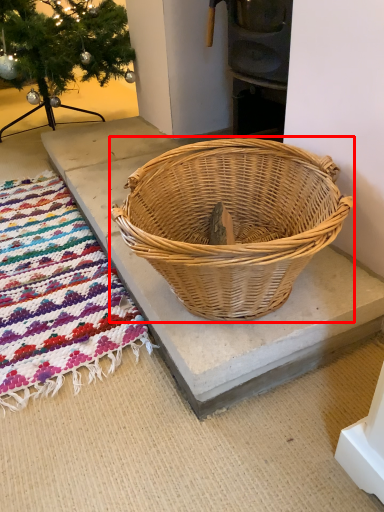
Question: Observing the image, what is the correct spatial positioning of picnic basket (annotated by the red box) in reference to mat?

Choices:
 (A) left
 (B) right

Answer: (B)